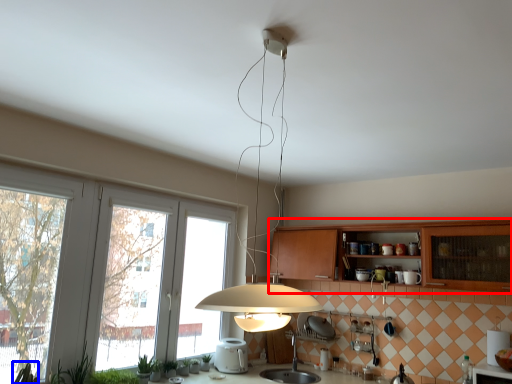
Question: Which object appears farthest to the camera in this image, cabinetry (highlighted by a red box) or plant (highlighted by a blue box)?

Choices:
 (A) cabinetry
 (B) plant

Answer: (A)